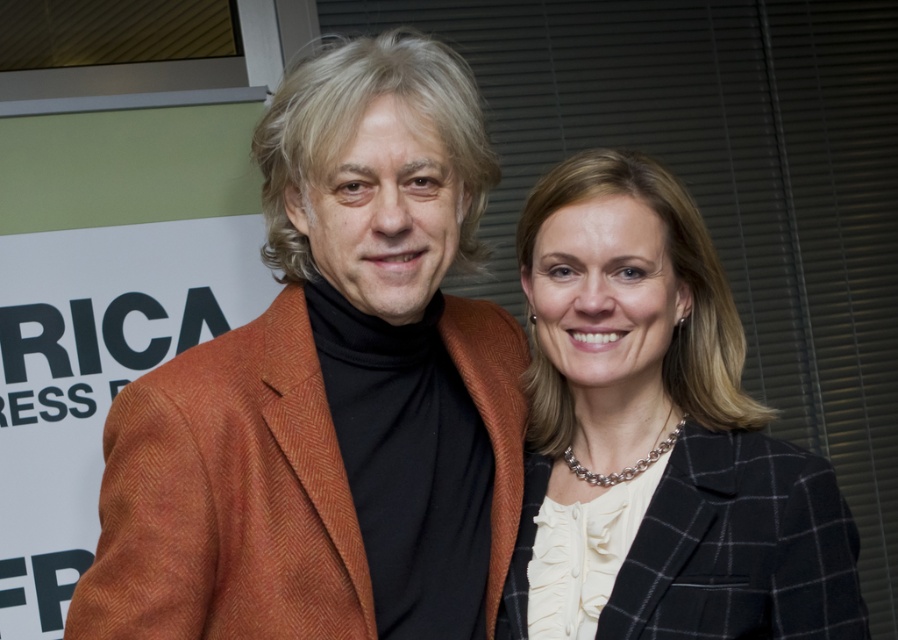
You are a photographer standing at a distance. You want to take a closeup photo of the orange herringbone blazer at center. Based on the scene description, can you estimate whether you are currently close enough to capture the blazer in detail without using a zoom lens?

The orange herringbone blazer at center and viewer are 38.49 inches apart from each other. A typical camera can capture details clearly at this distance without needing a zoom lens, so you are close enough to take a detailed photo of the orange herringbone blazer at center.

You are at a press event and need to take a photo of the orange herringbone blazer at center and the black textured blazer at center. Which blazer should you focus on first to ensure it appears sharp in the photo?

The orange herringbone blazer at center is in front of the black textured blazer at center, so you should focus on the orange herringbone blazer at center first to ensure it appears sharp in the photo.

You are a fashion designer observing two blazers in an image. The orange herringbone blazer at center and the black textured blazer at center are both displayed. If you need to place a 10 inch wide decorative ribbon between them, will there be enough space?

Answer: The orange herringbone blazer at center is 8.49 inches from the black textured blazer at center. Since the distance between them is less than 10 inches, placing a 10 inch wide decorative ribbon between them would not be possible as there isn